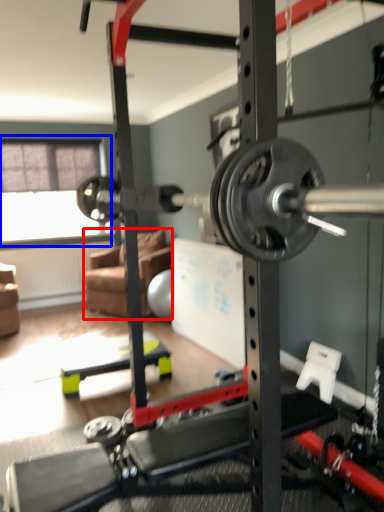
Question: Which of the following is the closest to the observer, couch (highlighted by a red box) or window screen (highlighted by a blue box)?

Choices:
 (A) couch
 (B) window screen

Answer: (A)